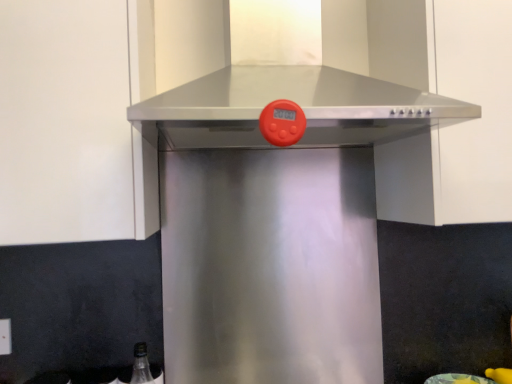
Identify the location of stainless steel range hood at center. The height and width of the screenshot is (384, 512). (474, 103).

What do you see at coordinates (474, 103) in the screenshot? This screenshot has width=512, height=384. I see `stainless steel range hood at center` at bounding box center [474, 103].

Where is `stainless steel vent at center`? stainless steel vent at center is located at coordinates (286, 72).

The width and height of the screenshot is (512, 384). Describe the element at coordinates (286, 72) in the screenshot. I see `stainless steel vent at center` at that location.

At what (x,y) coordinates should I click in order to perform the action: click on stainless steel range hood at center. Please return your answer as a coordinate pair (x, y). The height and width of the screenshot is (384, 512). Looking at the image, I should click on (474, 103).

Which is more to the left, stainless steel range hood at center or stainless steel vent at center?

Positioned to the left is stainless steel vent at center.

Which is behind, stainless steel range hood at center or stainless steel vent at center?

stainless steel range hood at center is further away from the camera.

Which is in front, point (473, 24) or point (272, 18)?

The point (473, 24) is more forward.

From the image's perspective, between stainless steel range hood at center and stainless steel vent at center, which one is located above?

stainless steel vent at center is shown above in the image.

From a real-world perspective, who is located lower, stainless steel range hood at center or stainless steel vent at center?

stainless steel range hood at center, from a real-world perspective.

Which of these two, stainless steel range hood at center or stainless steel vent at center, is thinner?

stainless steel range hood at center is thinner.

Who is shorter, stainless steel range hood at center or stainless steel vent at center?

stainless steel vent at center is shorter.

Is stainless steel range hood at center smaller than stainless steel vent at center?

Yes.

Is stainless steel range hood at center inside the boundaries of stainless steel vent at center, or outside?

stainless steel range hood at center is outside stainless steel vent at center.

Can you see stainless steel range hood at center touching stainless steel vent at center?

They are not placed beside each other.

Is stainless steel range hood at center turned away from stainless steel vent at center?

No, stainless steel range hood at center's orientation is not away from stainless steel vent at center.

Can you tell me how much stainless steel range hood at center and stainless steel vent at center differ in facing direction?

0.000864 degrees.

How distant is stainless steel range hood at center from stainless steel vent at center?

stainless steel range hood at center and stainless steel vent at center are 9.31 inches apart.

Find the location of `vent in front of the stainless steel range hood at center`. vent in front of the stainless steel range hood at center is located at coordinates (286, 72).

Considering the relative positions of stainless steel vent at center and stainless steel range hood at center in the image provided, is stainless steel vent at center to the right of stainless steel range hood at center from the viewer's perspective?

Incorrect, stainless steel vent at center is not on the right side of stainless steel range hood at center.

Is the depth of stainless steel vent at center greater than that of stainless steel range hood at center?

No, the depth of stainless steel vent at center is less than that of stainless steel range hood at center.

Is point (327, 32) closer or farther from the camera than point (454, 181)?

Point (327, 32).

From the image's perspective, which is above, stainless steel vent at center or stainless steel range hood at center?

stainless steel vent at center, from the image's perspective.

From a real-world perspective, is stainless steel vent at center positioned over stainless steel range hood at center based on gravity?

Yes, from a real-world perspective, stainless steel vent at center is over stainless steel range hood at center

Is stainless steel vent at center thinner than stainless steel range hood at center?

Incorrect, the width of stainless steel vent at center is not less than that of stainless steel range hood at center.

Which of these two, stainless steel vent at center or stainless steel range hood at center, stands taller?

stainless steel range hood at center.

Can you confirm if stainless steel vent at center is smaller than stainless steel range hood at center?

Actually, stainless steel vent at center might be larger than stainless steel range hood at center.

Is stainless steel vent at center positioned beyond the bounds of stainless steel range hood at center?

Yes, stainless steel vent at center is not within stainless steel range hood at center.

Is stainless steel vent at center not close to stainless steel range hood at center?

Actually, stainless steel vent at center and stainless steel range hood at center are a little close together.

Consider the image. Is stainless steel vent at center positioned with its back to stainless steel range hood at center?

No.

Can you tell me how much stainless steel vent at center and stainless steel range hood at center differ in facing direction?

There is a 0.000864-degree angle between the facing directions of stainless steel vent at center and stainless steel range hood at center.

Identify the location of vent lying on the left of stainless steel range hood at center. point(286,72).

This screenshot has width=512, height=384. What are the coordinates of `vent lying on the left of stainless steel range hood at center` in the screenshot? It's located at (286, 72).

The width and height of the screenshot is (512, 384). I want to click on vent above the stainless steel range hood at center (from the image's perspective), so click(x=286, y=72).